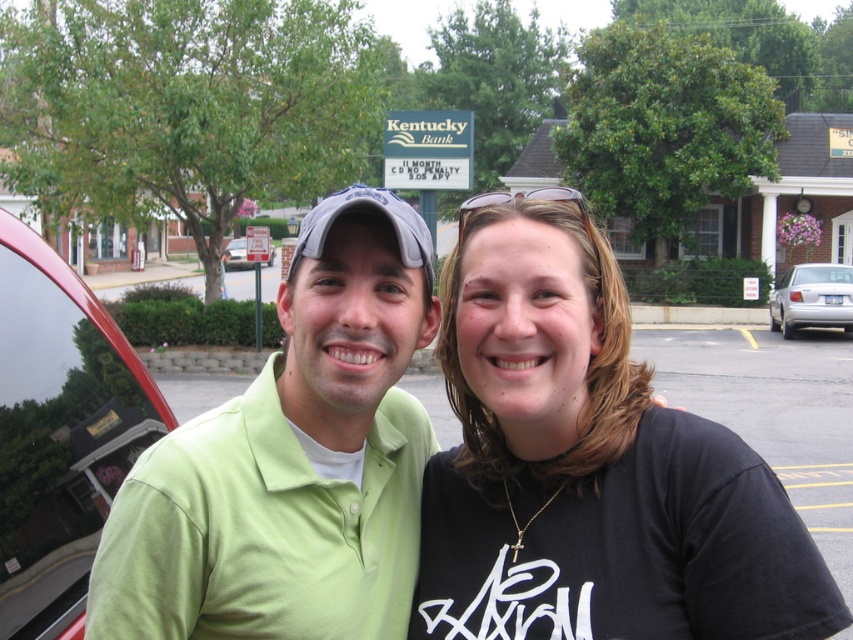
Question: Which object is closer to the camera taking this photo?

Choices:
 (A) green cotton polo shirt at center
 (B) green cotton shirt at center
 (C) metallic silver car at left
 (D) shiny red car at left

Answer: (B)

Question: From the image, what is the correct spatial relationship of green cotton polo shirt at center in relation to shiny red car at left?

Choices:
 (A) below
 (B) above

Answer: (B)

Question: Among these objects, which one is farthest from the camera?

Choices:
 (A) silver metallic sedan at right
 (B) green cotton shirt at center
 (C) metallic silver car at left

Answer: (A)

Question: Is green cotton shirt at center above silver metallic sedan at right?

Choices:
 (A) yes
 (B) no

Answer: (B)

Question: Is green cotton polo shirt at center to the left of silver metallic sedan at right from the viewer's perspective?

Choices:
 (A) no
 (B) yes

Answer: (B)

Question: Which object appears farthest from the camera in this image?

Choices:
 (A) green cotton polo shirt at center
 (B) metallic silver car at left
 (C) shiny red car at left

Answer: (B)